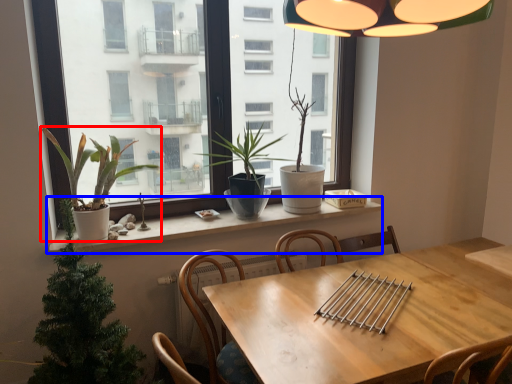
Question: Which object is closer to the camera taking this photo, houseplant (highlighted by a red box) or window sill (highlighted by a blue box)?

Choices:
 (A) houseplant
 (B) window sill

Answer: (A)